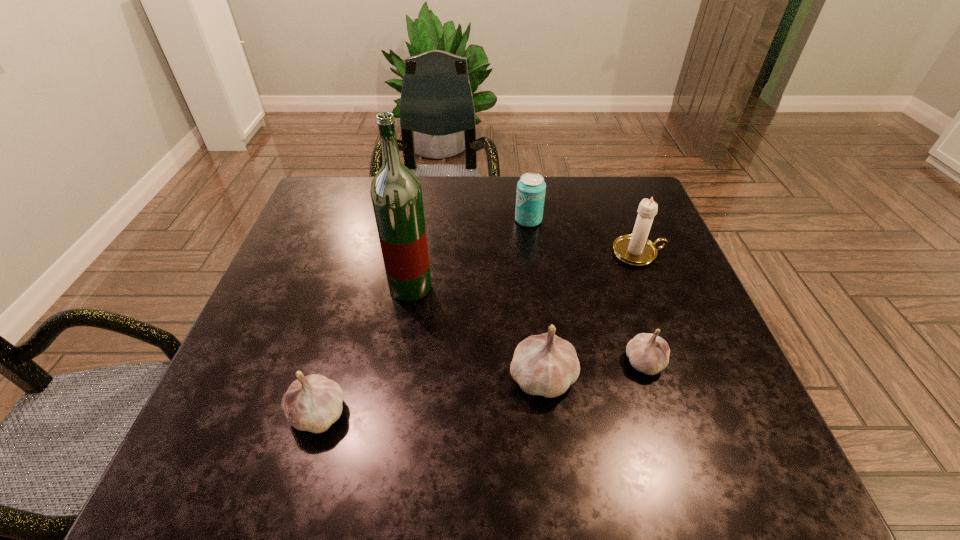
Locate an element on the screen. The width and height of the screenshot is (960, 540). vacant point at the near edge is located at coordinates (637, 397).

What are the coordinates of `vacant area at the left edge` in the screenshot? It's located at (331, 234).

In the image, there is a desktop. Where is `vacant region at the right edge`? vacant region at the right edge is located at coordinates (x=708, y=321).

In the image, there is a desktop. Find the location of `vacant space at the far left corner`. vacant space at the far left corner is located at coordinates [x=351, y=219].

In the image, there is a desktop. Where is `vacant space at the far right corner`? vacant space at the far right corner is located at coordinates (612, 213).

Where is `blank region between the second garlic from right to left and the shortest garlic`? This screenshot has height=540, width=960. blank region between the second garlic from right to left and the shortest garlic is located at coordinates (593, 370).

Where is `vacant region between the beer can and the shortest object`? Image resolution: width=960 pixels, height=540 pixels. vacant region between the beer can and the shortest object is located at coordinates coord(587,291).

Find the location of `empty space between the beer can and the shortest object`. empty space between the beer can and the shortest object is located at coordinates (587, 291).

The width and height of the screenshot is (960, 540). Find the location of `free space between the shortest garlic and the beer can`. free space between the shortest garlic and the beer can is located at coordinates (587, 291).

I want to click on free spot between the second garlic from left to right and the second farthest object, so click(x=590, y=315).